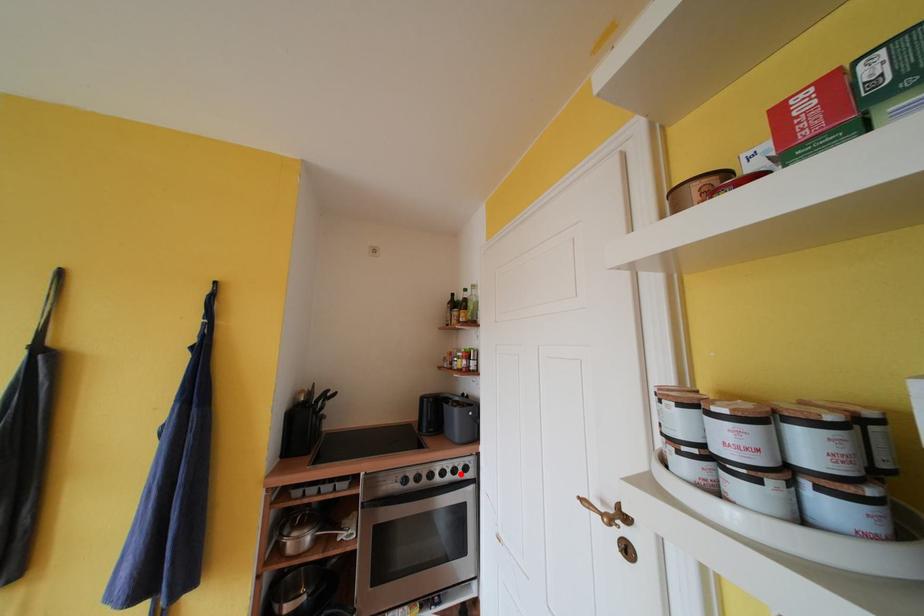
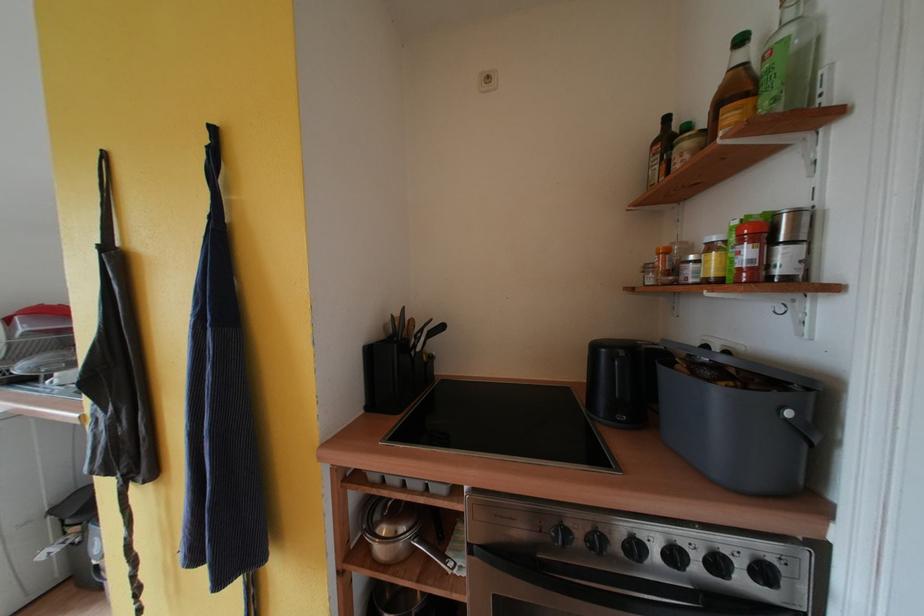
Question: A red point is marked in image1. In image2, is the corresponding 3D point closer to the camera or farther? Reply with the corresponding letter.

Choices:
 (A) The corresponding 3D point is closer.
 (B) The corresponding 3D point is farther.

Answer: (A)